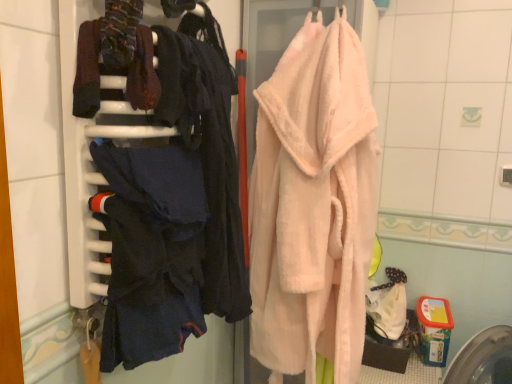
Question: Looking at the image, does dark blue fabric at left seem bigger or smaller compared to soft pink plush bathrobe at center?

Choices:
 (A) big
 (B) small

Answer: (B)

Question: From the image's perspective, is dark blue fabric at left positioned above or below soft pink plush bathrobe at center?

Choices:
 (A) below
 (B) above

Answer: (B)

Question: Which is farther from the dark blue fabric at left?

Choices:
 (A) dark blue fabric at left
 (B) soft pink plush bathrobe at center

Answer: (B)

Question: Which is farther from the soft pink plush bathrobe at center?

Choices:
 (A) dark blue fabric at left
 (B) dark blue fabric at left

Answer: (A)